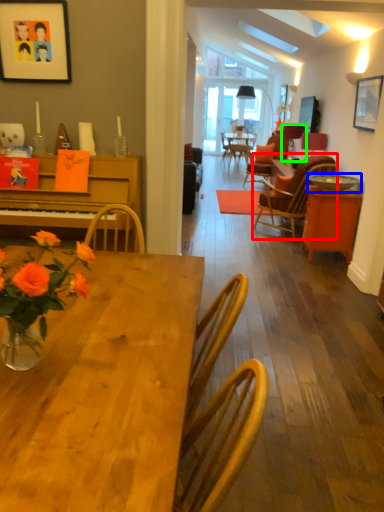
Question: Which is nearer to the chair (highlighted by a red box)? bowl (highlighted by a blue box) or lamp (highlighted by a green box).

Choices:
 (A) bowl
 (B) lamp

Answer: (B)